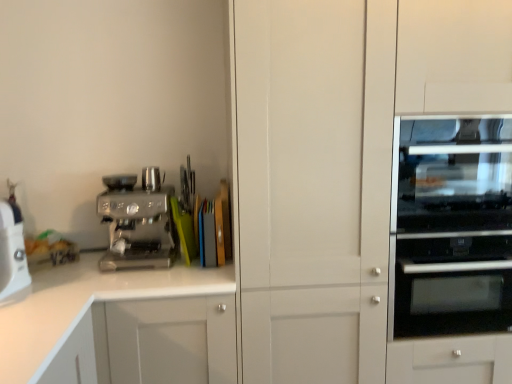
Question: Does satin chrome espresso machine at left have a greater height compared to transparent glass oven at right?

Choices:
 (A) no
 (B) yes

Answer: (A)

Question: Is satin chrome espresso machine at left beside transparent glass oven at right?

Choices:
 (A) yes
 (B) no

Answer: (B)

Question: Considering the relative sizes of satin chrome espresso machine at left and transparent glass oven at right in the image provided, is satin chrome espresso machine at left shorter than transparent glass oven at right?

Choices:
 (A) no
 (B) yes

Answer: (B)

Question: Can you confirm if satin chrome espresso machine at left is positioned to the right of transparent glass oven at right?

Choices:
 (A) yes
 (B) no

Answer: (B)

Question: Is satin chrome espresso machine at left to the left of transparent glass oven at right from the viewer's perspective?

Choices:
 (A) yes
 (B) no

Answer: (A)

Question: Visually, is transparent glass oven at right positioned to the left or to the right of white plastic food processor at left?

Choices:
 (A) left
 (B) right

Answer: (B)

Question: Do you think transparent glass oven at right is within white plastic food processor at left, or outside of it?

Choices:
 (A) inside
 (B) outside

Answer: (B)

Question: Is transparent glass oven at right in front of or behind white plastic food processor at left in the image?

Choices:
 (A) front
 (B) behind

Answer: (A)

Question: From their relative heights in the image, would you say transparent glass oven at right is taller or shorter than white plastic food processor at left?

Choices:
 (A) short
 (B) tall

Answer: (B)

Question: From the image's perspective, is white plastic food processor at left positioned above or below satin chrome espresso machine at left?

Choices:
 (A) below
 (B) above

Answer: (A)

Question: Is white plastic food processor at left bigger or smaller than satin chrome espresso machine at left?

Choices:
 (A) big
 (B) small

Answer: (B)

Question: In terms of height, does white plastic food processor at left look taller or shorter compared to satin chrome espresso machine at left?

Choices:
 (A) tall
 (B) short

Answer: (A)

Question: Looking at their shapes, would you say white plastic food processor at left is wider or thinner than satin chrome espresso machine at left?

Choices:
 (A) thin
 (B) wide

Answer: (A)

Question: From the image's perspective, is white glossy cabinet at lower left located above or below satin chrome espresso machine at left?

Choices:
 (A) below
 (B) above

Answer: (A)

Question: Relative to satin chrome espresso machine at left, is white glossy cabinet at lower left in front or behind?

Choices:
 (A) front
 (B) behind

Answer: (A)